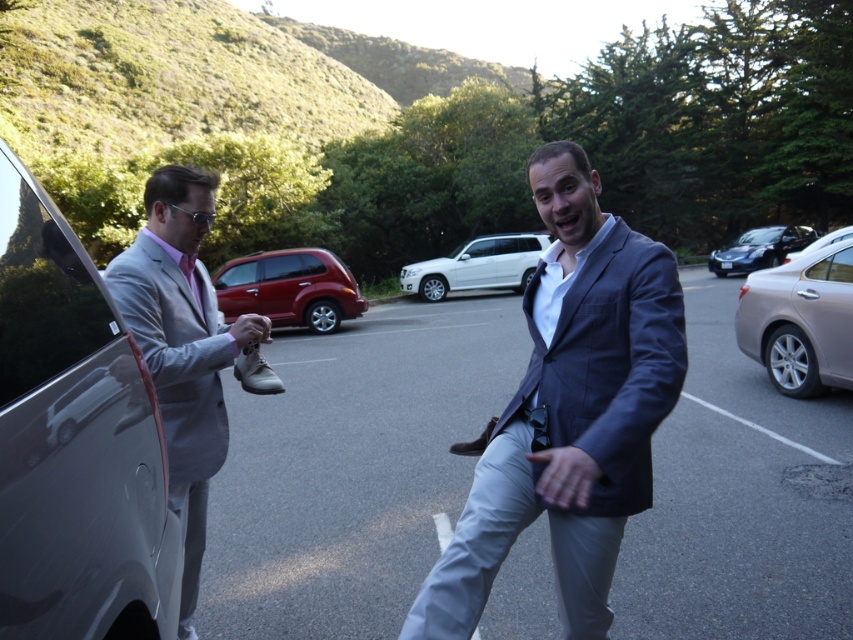
Who is positioned more to the right, matte blue blazer at center or white leather shoe at lower center?

From the viewer's perspective, matte blue blazer at center appears more on the right side.

Can you confirm if matte blue blazer at center is positioned to the left of white leather shoe at lower center?

In fact, matte blue blazer at center is to the right of white leather shoe at lower center.

Find the location of `matte blue blazer at center`. matte blue blazer at center is located at coordinates (569, 410).

Does matte gray suit at left appear on the right side of matte gray shoe at center?

Indeed, matte gray suit at left is positioned on the right side of matte gray shoe at center.

Locate an element on the screen. The width and height of the screenshot is (853, 640). matte gray suit at left is located at coordinates (183, 346).

You are a GUI agent. You are given a task and a screenshot of the screen. Output one action in this format:
    pyautogui.click(x=<x>, y=<y>)
    Task: Click on the matte gray suit at left
    This screenshot has width=853, height=640.
    Given the screenshot: What is the action you would take?
    pyautogui.click(x=183, y=346)

Measure the distance between white leather shoe at lower center and pink satin tie at left.

white leather shoe at lower center is 12.71 inches away from pink satin tie at left.

Is white leather shoe at lower center smaller than pink satin tie at left?

Incorrect, white leather shoe at lower center is not smaller in size than pink satin tie at left.

What do you see at coordinates (254, 371) in the screenshot? This screenshot has width=853, height=640. I see `white leather shoe at lower center` at bounding box center [254, 371].

Identify the location of white leather shoe at lower center. Image resolution: width=853 pixels, height=640 pixels. (254, 371).